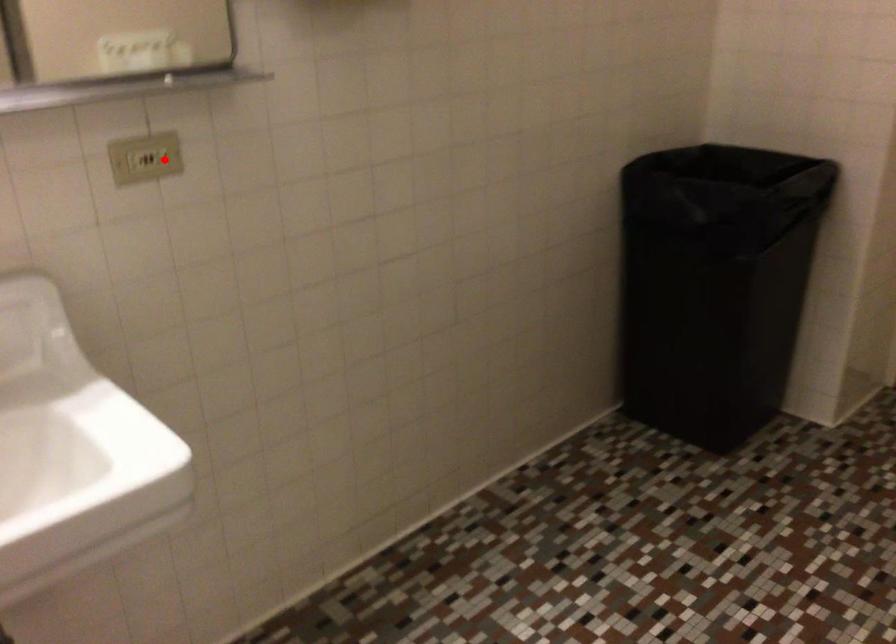
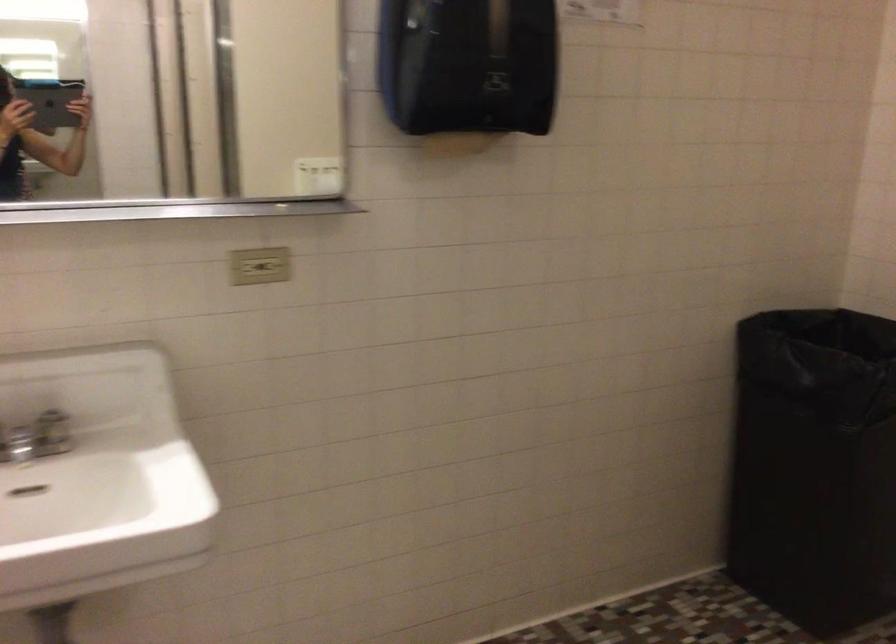
Locate, in the second image, the point that corresponds to the highlighted location in the first image.

(273, 266)